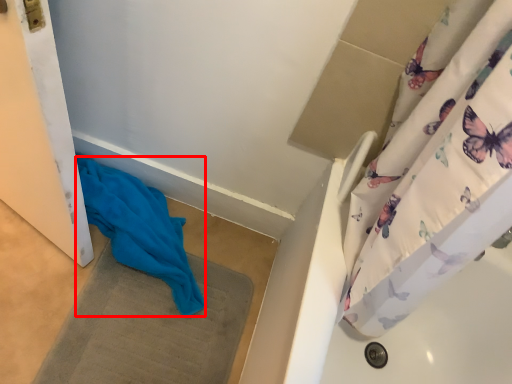
Question: Where is fabric (annotated by the red box) located in relation to bath mat in the image?

Choices:
 (A) right
 (B) left

Answer: (B)